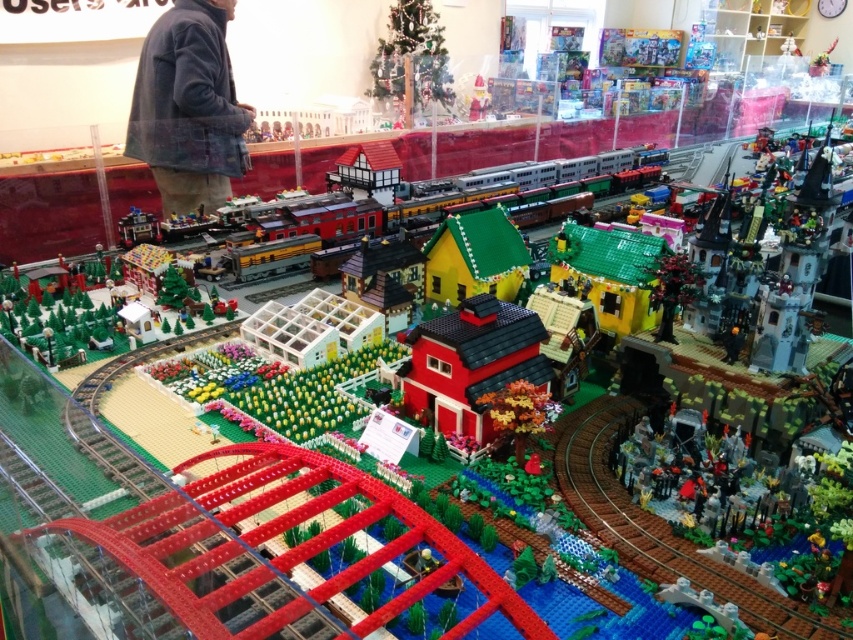
Question: Which is nearer to the matte white santa at upper center?

Choices:
 (A) fuzzy blue jacket at upper left
 (B) brick train at center

Answer: (B)

Question: Which point is closer to the camera?

Choices:
 (A) matte white santa at upper center
 (B) brick red barn at center
 (C) brick train at center

Answer: (B)

Question: Is fuzzy blue jacket at upper left further to camera compared to matte white santa at upper center?

Choices:
 (A) yes
 (B) no

Answer: (B)

Question: Considering the relative positions of fuzzy blue jacket at upper left and brick train at center in the image provided, where is fuzzy blue jacket at upper left located with respect to brick train at center?

Choices:
 (A) right
 (B) left

Answer: (B)

Question: Does fuzzy blue jacket at upper left appear over brick train at center?

Choices:
 (A) no
 (B) yes

Answer: (B)

Question: Which point is closer to the camera?

Choices:
 (A) (172, 122)
 (B) (473, 92)
 (C) (219, 268)

Answer: (C)